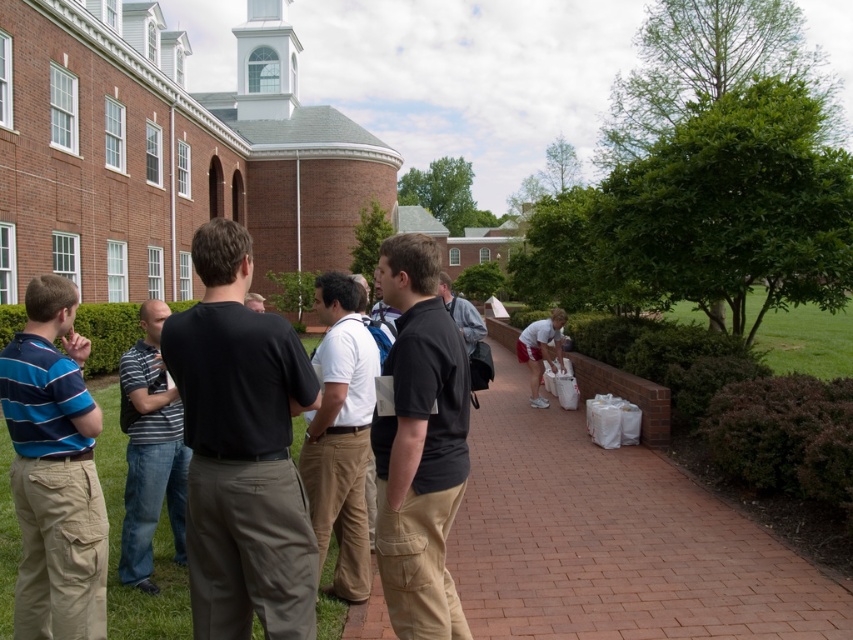
In the scene shown: Between brick pathway at center and gray fabric jacket at center, which one is positioned higher?

gray fabric jacket at center

From the picture: Which is below, brick pathway at center or gray fabric jacket at center?

brick pathway at center

Which is in front, point (640, 609) or point (453, 310)?

Point (640, 609) is in front.

Where is `brick pathway at center`? Image resolution: width=853 pixels, height=640 pixels. brick pathway at center is located at coordinates (613, 538).

Who is shorter, gray fabric jacket at center or white matte shorts at lower center?

gray fabric jacket at center

Can you confirm if gray fabric jacket at center is bigger than white matte shorts at lower center?

Yes, gray fabric jacket at center is bigger than white matte shorts at lower center.

Image resolution: width=853 pixels, height=640 pixels. Identify the location of gray fabric jacket at center. (468, 336).

Can you confirm if brick pathway at center is positioned to the right of black cotton shirt at center?

Indeed, brick pathway at center is positioned on the right side of black cotton shirt at center.

Which is behind, point (611, 468) or point (201, 269)?

The point (611, 468) is more distant.

Identify the location of brick pathway at center. This screenshot has height=640, width=853. (613, 538).